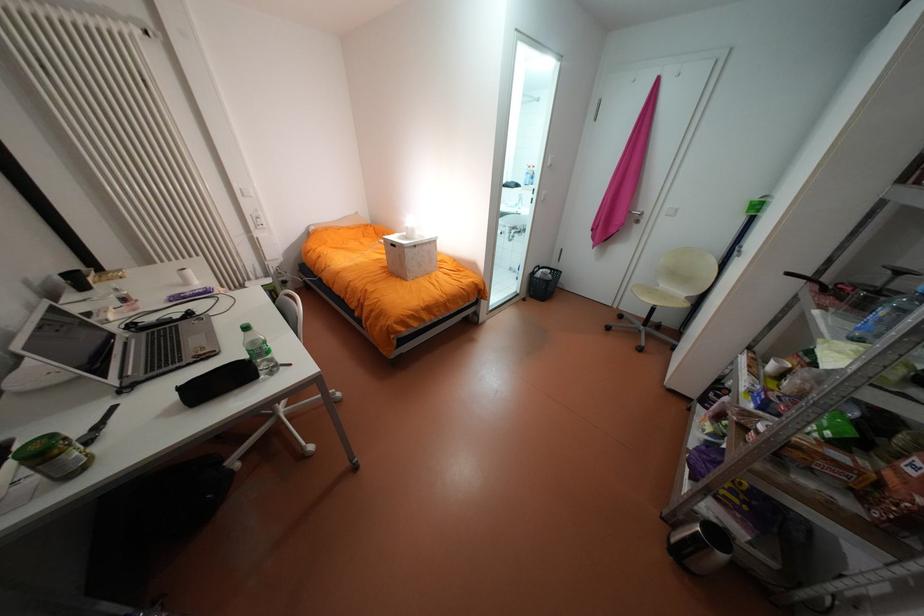
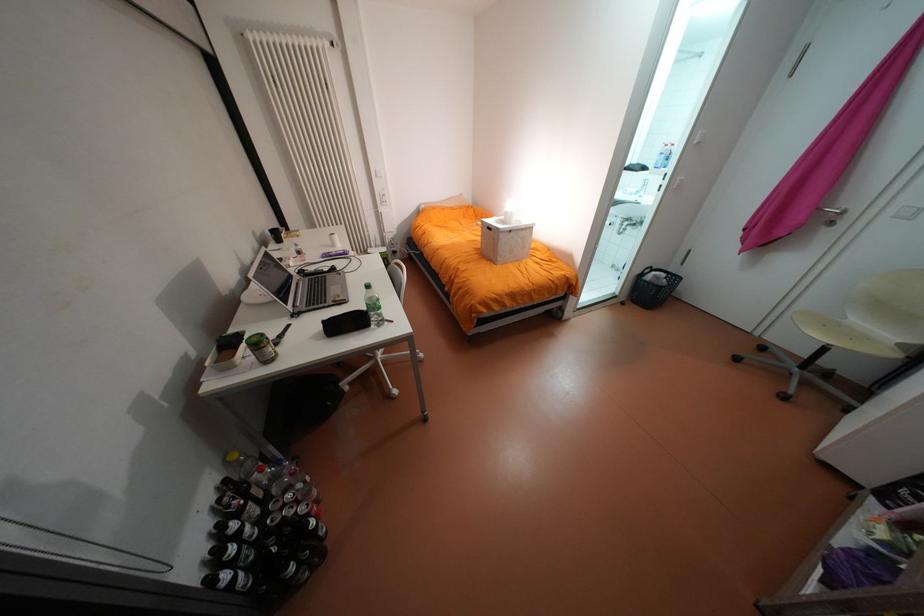
Where in the second image is the point corresponding to point 266,376 from the first image?

(379, 325)